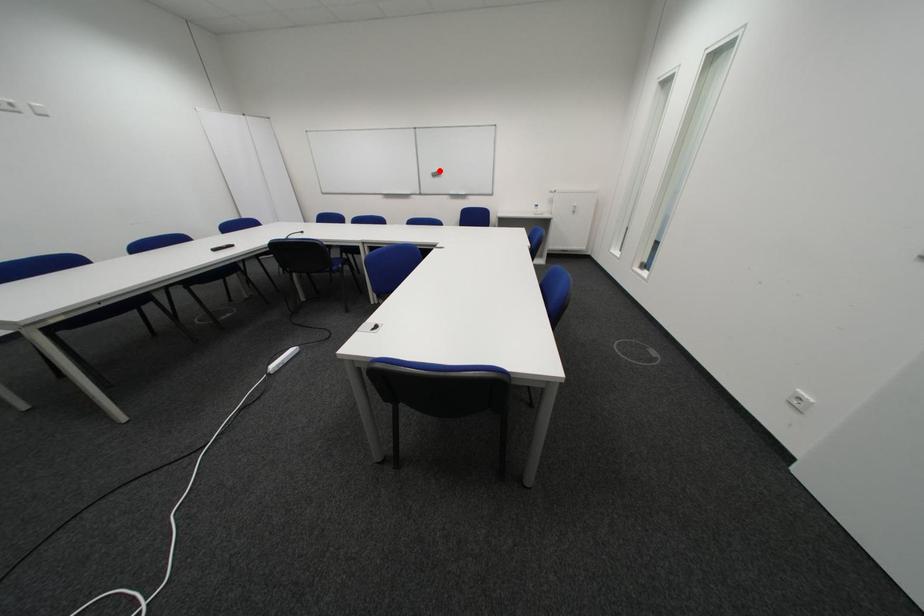
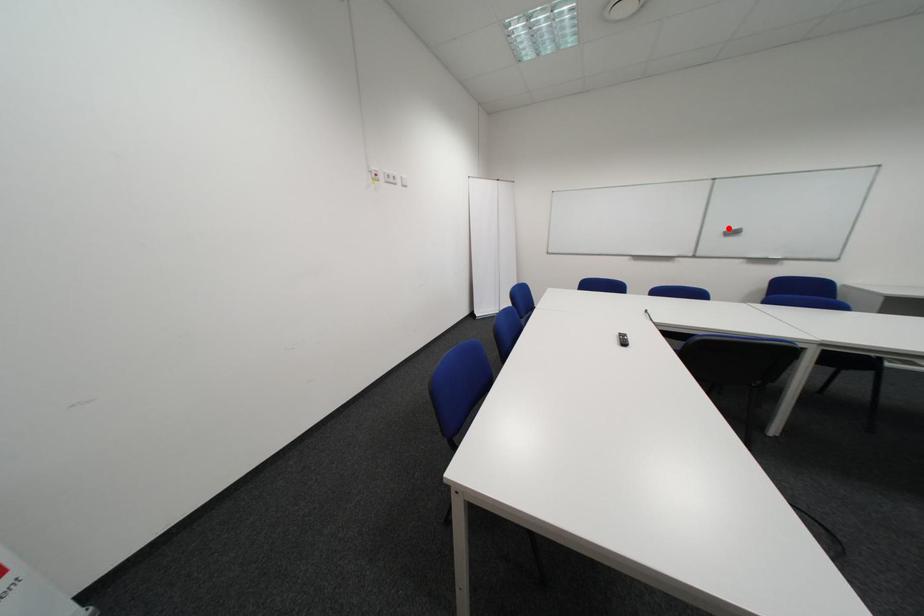
I am providing you with two images of the same scene from different viewpoints. A red point is marked on the first image and another point is marked on the second image. Do the highlighted points in image1 and image2 indicate the same real-world spot?

Yes